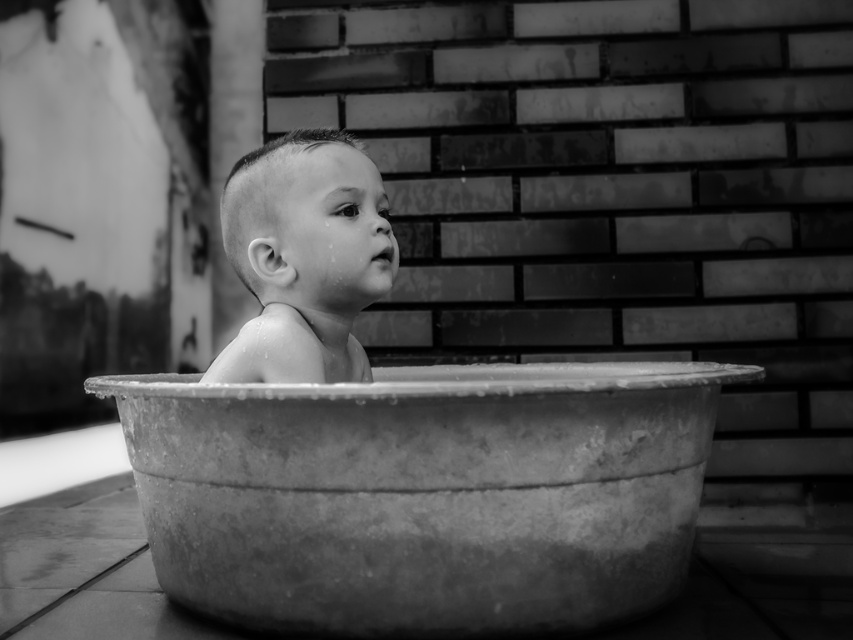
Question: Does metallic tub at center have a larger size compared to smooth skin baby at center?

Choices:
 (A) yes
 (B) no

Answer: (A)

Question: Which of the following is the farthest from the observer?

Choices:
 (A) metallic tub at center
 (B) smooth skin baby at center

Answer: (B)

Question: Does metallic tub at center appear on the left side of smooth skin baby at center?

Choices:
 (A) no
 (B) yes

Answer: (A)

Question: From the image, what is the correct spatial relationship of metallic tub at center in relation to smooth skin baby at center?

Choices:
 (A) left
 (B) right

Answer: (B)

Question: Which object is closer to the camera taking this photo?

Choices:
 (A) metallic tub at center
 (B) smooth skin baby at center

Answer: (A)